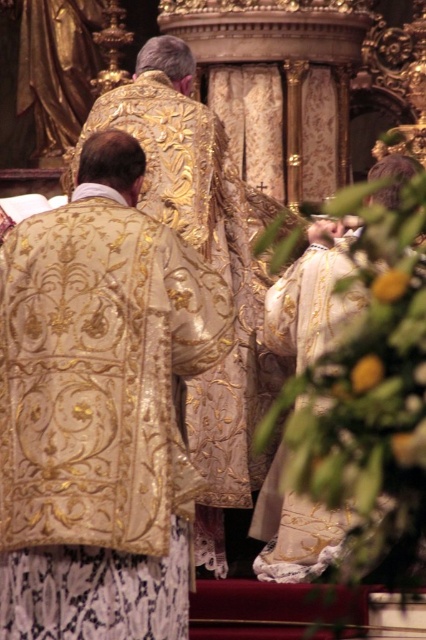
Does gold embroidered robe at center have a lesser width compared to white embroidered robe at center?

No, gold embroidered robe at center is not thinner than white embroidered robe at center.

Who is more distant from viewer, (152,269) or (330,296)?

The point (330,296) is more distant.

Is point (40, 497) closer to viewer compared to point (308, 508)?

Yes, it is.

The width and height of the screenshot is (426, 640). What are the coordinates of `gold embroidered robe at center` in the screenshot? It's located at (100, 420).